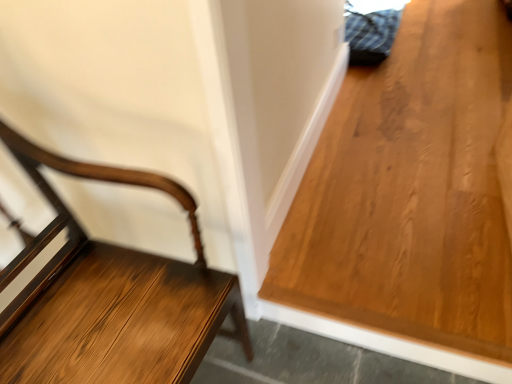
In order to face wooden chair at left, should I rotate leftwards or rightwards?

You should rotate left by 21.702 degrees.

Find the location of a particular element. wooden chair at left is located at coordinates pos(113,297).

The height and width of the screenshot is (384, 512). What do you see at coordinates (113, 297) in the screenshot?
I see `wooden chair at left` at bounding box center [113, 297].

Where is `wooden chair at left`? The height and width of the screenshot is (384, 512). wooden chair at left is located at coordinates (113, 297).